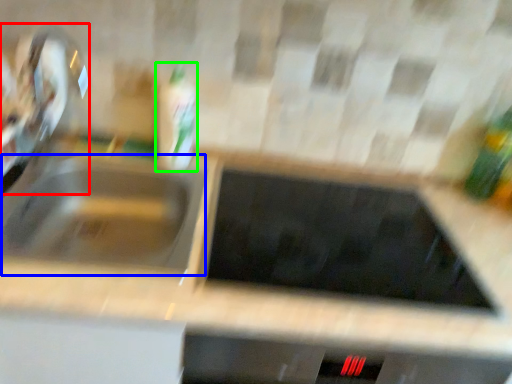
Question: Based on their relative distances, which object is nearer to faucet (highlighted by a red box)? Choose from sink (highlighted by a blue box) and bottle (highlighted by a green box).

Choices:
 (A) sink
 (B) bottle

Answer: (A)